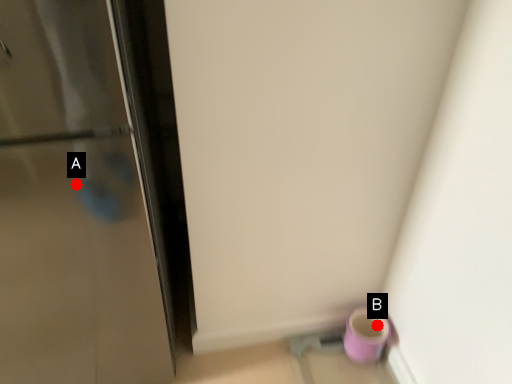
Question: Two points are circled on the image, labeled by A and B beside each circle. Which point is further to the camera?

Choices:
 (A) A is further
 (B) B is further

Answer: (B)